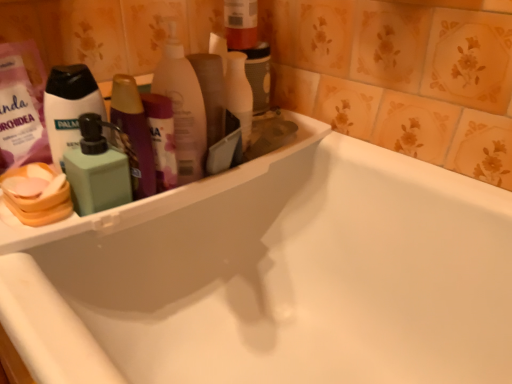
Question: Should I look upward or downward to see translucent plastic bottle at upper center, which is the first cleaning product in right-to-left order?

Choices:
 (A) up
 (B) down

Answer: (A)

Question: From a real-world perspective, is green matte soap dispenser at left, which ranks as the 1th cleaning product in left-to-right order, located higher than translucent plastic bottle at upper center, which is the second cleaning product from left to right?

Choices:
 (A) yes
 (B) no

Answer: (B)

Question: Considering the relative positions of green matte soap dispenser at left, which is counted as the 2th cleaning product, starting from the right, and translucent plastic bottle at upper center, which is the second cleaning product from left to right, in the image provided, is green matte soap dispenser at left, which is counted as the 2th cleaning product, starting from the right, to the left of translucent plastic bottle at upper center, which is the second cleaning product from left to right, from the viewer's perspective?

Choices:
 (A) yes
 (B) no

Answer: (A)

Question: Considering the relative sizes of green matte soap dispenser at left, which is counted as the 2th cleaning product, starting from the right, and translucent plastic bottle at upper center, which is the first cleaning product in right-to-left order, in the image provided, is green matte soap dispenser at left, which is counted as the 2th cleaning product, starting from the right, wider than translucent plastic bottle at upper center, which is the first cleaning product in right-to-left order,?

Choices:
 (A) no
 (B) yes

Answer: (A)

Question: Considering the relative sizes of green matte soap dispenser at left, which is counted as the 2th cleaning product, starting from the right, and translucent plastic bottle at upper center, which is the first cleaning product in right-to-left order, in the image provided, is green matte soap dispenser at left, which is counted as the 2th cleaning product, starting from the right, smaller than translucent plastic bottle at upper center, which is the first cleaning product in right-to-left order,?

Choices:
 (A) yes
 (B) no

Answer: (A)

Question: Could you tell me if green matte soap dispenser at left, which ranks as the 1th cleaning product in left-to-right order, is turned towards translucent plastic bottle at upper center, which is the first cleaning product in right-to-left order?

Choices:
 (A) no
 (B) yes

Answer: (A)

Question: Is green matte soap dispenser at left, which is counted as the 2th cleaning product, starting from the right, far from translucent plastic bottle at upper center, which is the second cleaning product from left to right?

Choices:
 (A) no
 (B) yes

Answer: (A)

Question: From a real-world perspective, is translucent plastic bottle at upper center, which is the first cleaning product in right-to-left order, over green matte pump bottle at left?

Choices:
 (A) yes
 (B) no

Answer: (A)

Question: From a real-world perspective, is translucent plastic bottle at upper center, which is the second cleaning product from left to right, below green matte pump bottle at left?

Choices:
 (A) no
 (B) yes

Answer: (A)

Question: Can you confirm if translucent plastic bottle at upper center, which is the second cleaning product from left to right, is taller than green matte pump bottle at left?

Choices:
 (A) yes
 (B) no

Answer: (A)

Question: Considering the relative sizes of translucent plastic bottle at upper center, which is the second cleaning product from left to right, and green matte pump bottle at left in the image provided, is translucent plastic bottle at upper center, which is the second cleaning product from left to right, smaller than green matte pump bottle at left?

Choices:
 (A) no
 (B) yes

Answer: (A)

Question: Does translucent plastic bottle at upper center, which is the first cleaning product in right-to-left order, lie behind green matte pump bottle at left?

Choices:
 (A) yes
 (B) no

Answer: (A)

Question: Is translucent plastic bottle at upper center, which is the second cleaning product from left to right, wider than green matte pump bottle at left?

Choices:
 (A) no
 (B) yes

Answer: (B)

Question: Can you confirm if green matte soap dispenser at left, which ranks as the 1th cleaning product in left-to-right order, is thinner than green matte pump bottle at left?

Choices:
 (A) yes
 (B) no

Answer: (B)